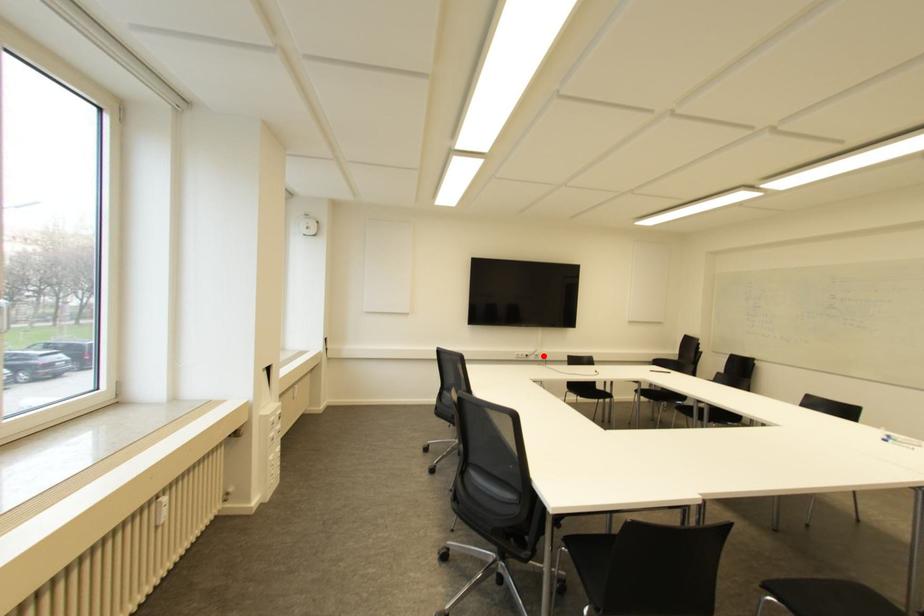
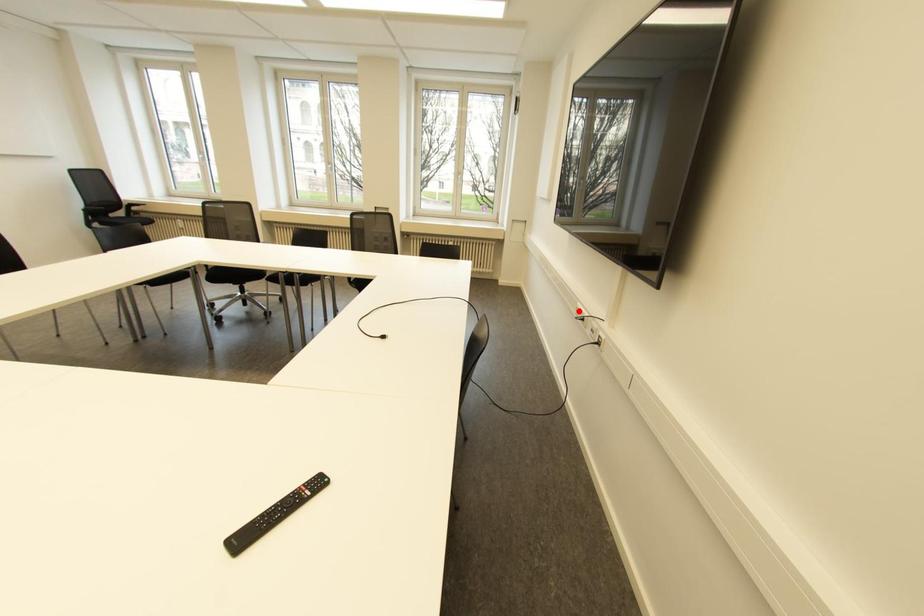
I am providing you with two images of the same scene from different viewpoints. A red point is marked on the first image and another point is marked on the second image. Is the red point in image1 aligned with the point shown in image2?

No